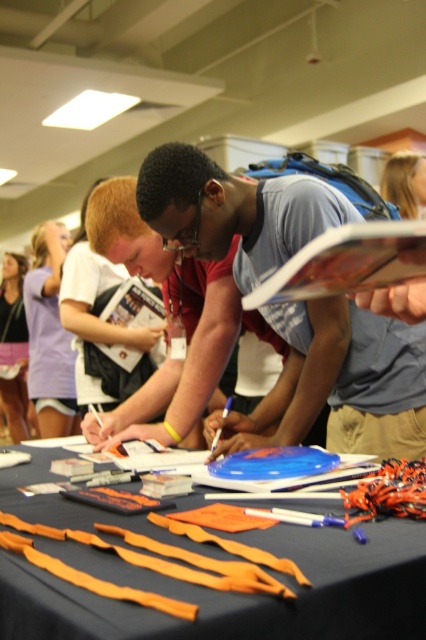
You are organizing a community event and need to determine if the matte blue shirt at center can be displayed next to the orange fabric strips at lower center without overlapping. Based on their widths, is this possible?

The matte blue shirt at center might be wider than orange fabric strips at lower center, so there is a possibility of overlapping if placed side by side. Consider arranging them with sufficient spacing to avoid overlap.

You are an attendee at this event and want to pick up the orange fabric strips at lower center. Is the matte blue shirt at center blocking your access to them?

The matte blue shirt at center is positioned over orange fabric strips at lower center, so yes, the matte blue shirt at center is blocking access to the orange fabric strips at lower center.